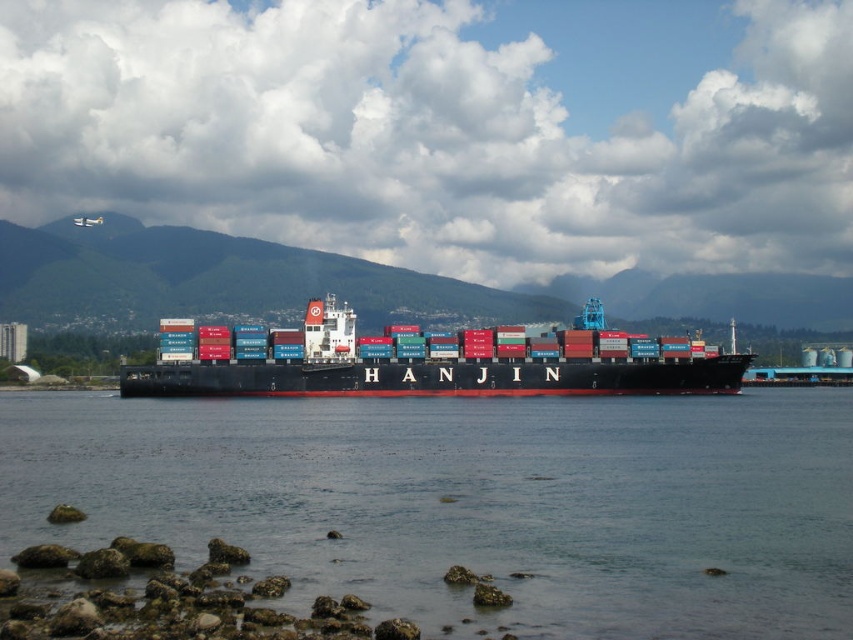
You are a photographer planning to capture the clear water at center and the red matte container ship at center in a single shot. Given that your camera can only focus on one object at a time, which object should you prioritize focusing on to ensure the other remains in the background?

The clear water at center is wider than the red matte container ship at center, so you should focus on the red matte container ship at center to keep the wider clear water at center in the background.

You are a photographer planning to capture the red matte container ship at center and the clear water at center in a single shot. Which object will appear taller in the photo?

The red matte container ship at center will appear taller in the photo since it is taller than the clear water at center according to the description.